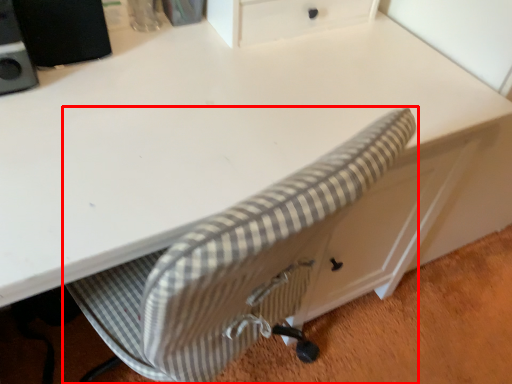
Question: Observing the image, what is the correct spatial positioning of chair (annotated by the red box) in reference to speaker?

Choices:
 (A) right
 (B) left

Answer: (A)